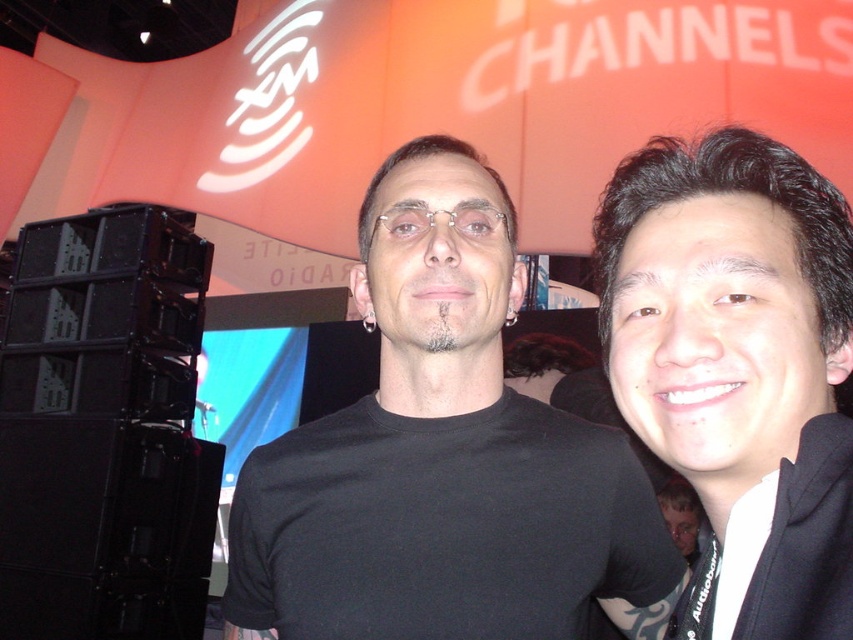
Who is higher up, smooth skin face at right or white matte hoodie at right?

smooth skin face at right

Can you confirm if smooth skin face at right is shorter than white matte hoodie at right?

No, smooth skin face at right is not shorter than white matte hoodie at right.

At what (x,y) coordinates should I click in order to perform the action: click on smooth skin face at right. Please return your answer as a coordinate pair (x, y). The image size is (853, 640). Looking at the image, I should click on (717, 339).

Does black matte t-shirt at center appear over smooth skin face at right?

No.

Which of these two, black matte t-shirt at center or smooth skin face at right, stands shorter?

With less height is smooth skin face at right.

The width and height of the screenshot is (853, 640). What are the coordinates of `black matte t-shirt at center` in the screenshot? It's located at (440, 452).

Looking at this image, is black matte t-shirt at center to the left of black hoodie at right from the viewer's perspective?

Yes, black matte t-shirt at center is to the left of black hoodie at right.

At what (x,y) coordinates should I click in order to perform the action: click on black matte t-shirt at center. Please return your answer as a coordinate pair (x, y). Looking at the image, I should click on (440, 452).